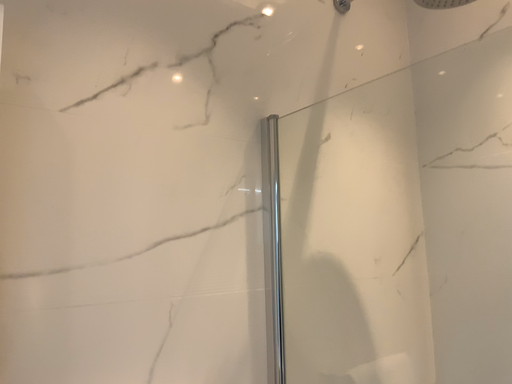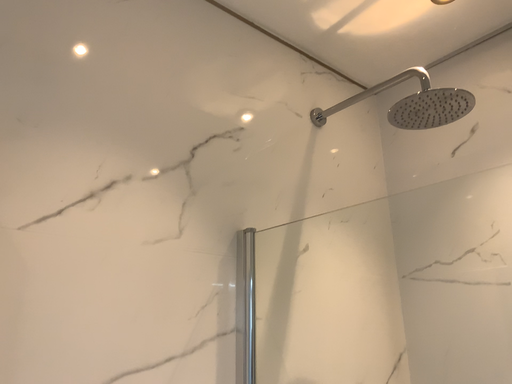
Question: Which way did the camera rotate in the video?

Choices:
 (A) rotated upward
 (B) rotated downward

Answer: (A)